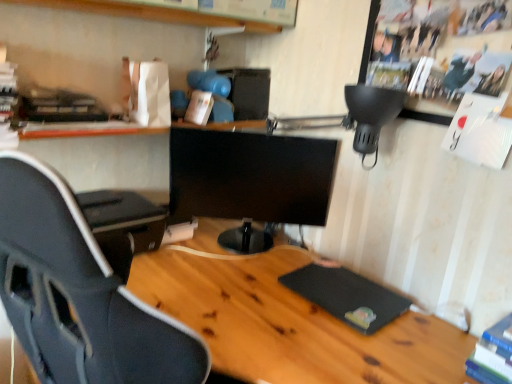
You are a GUI agent. You are given a task and a screenshot of the screen. Output one action in this format:
    pyautogui.click(x=<x>, y=<y>)
    Task: Click on the free space between black glossy monitor at center and black rubber mousepad at lower right
    
    Given the screenshot: What is the action you would take?
    pyautogui.click(x=254, y=276)